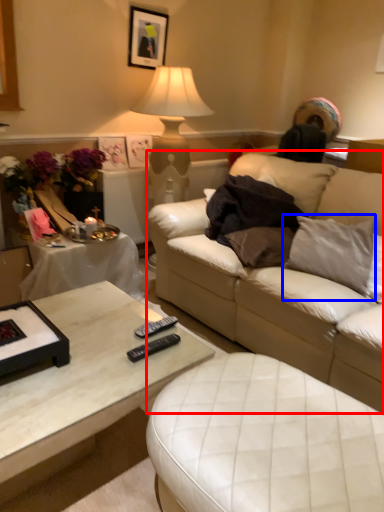
Question: Which point is further to the camera, studio couch (highlighted by a red box) or pillow (highlighted by a blue box)?

Choices:
 (A) studio couch
 (B) pillow

Answer: (B)